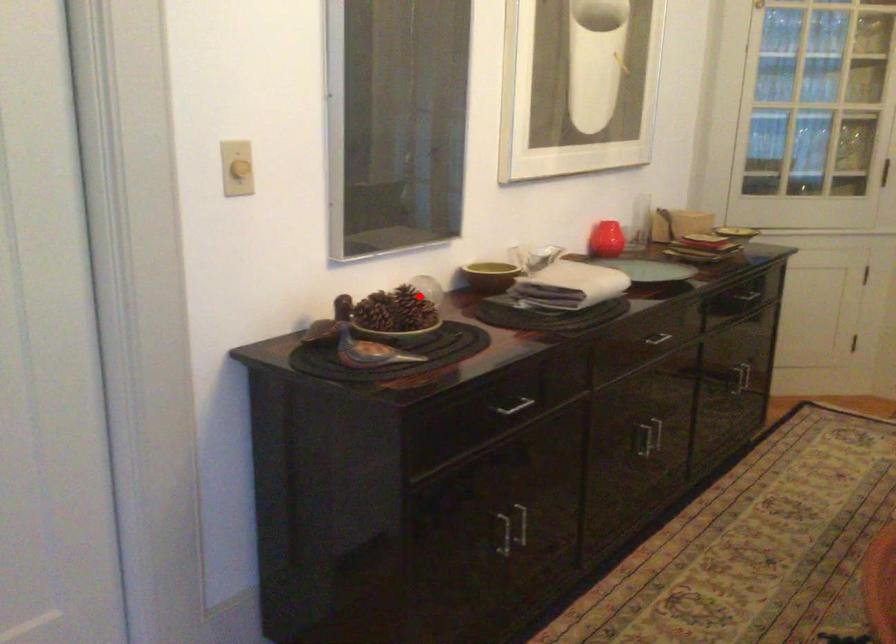
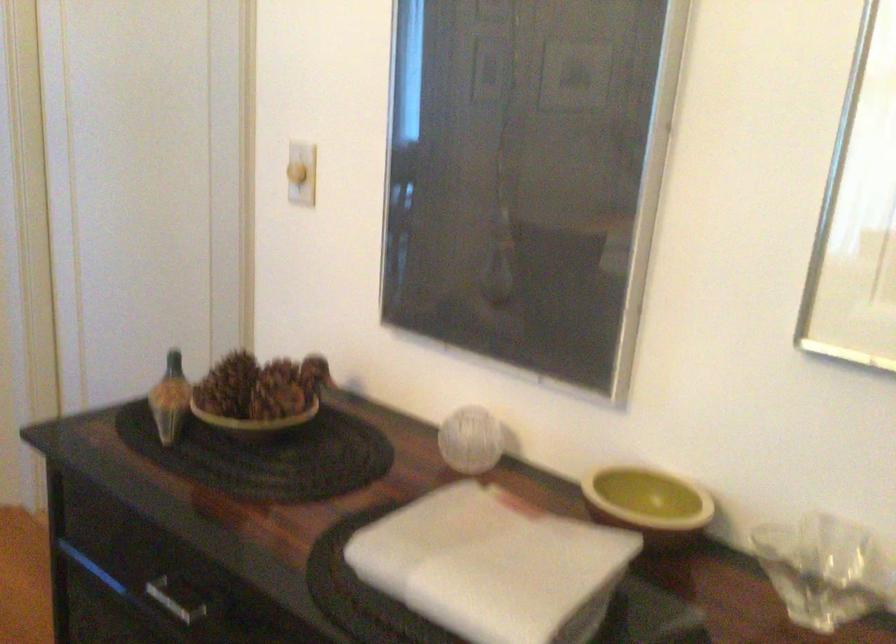
Question: I am providing you with two images of the same scene from different viewpoints. Image1 has a red point marked. In image2, the corresponding 3D location appears at what relative position? Reply with the corresponding letter.

Choices:
 (A) Closer
 (B) Farther

Answer: (A)